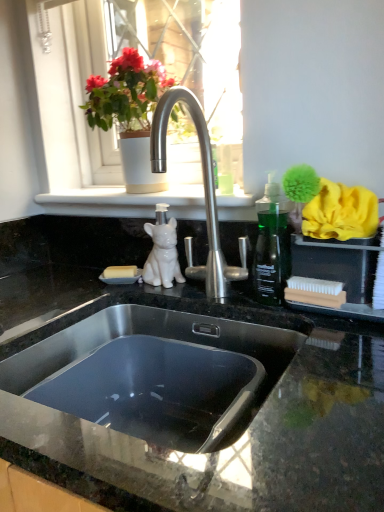
Question: Is black granite countertop at center at the left side of white glossy dog at center?

Choices:
 (A) no
 (B) yes

Answer: (B)

Question: From the image's perspective, is black granite countertop at center located above white glossy dog at center?

Choices:
 (A) yes
 (B) no

Answer: (B)

Question: Does black granite countertop at center have a greater width compared to white glossy dog at center?

Choices:
 (A) yes
 (B) no

Answer: (A)

Question: Can you confirm if black granite countertop at center is positioned to the right of white glossy dog at center?

Choices:
 (A) no
 (B) yes

Answer: (A)

Question: Is black granite countertop at center facing towards white glossy dog at center?

Choices:
 (A) no
 (B) yes

Answer: (A)

Question: Is point (163, 225) closer or farther from the camera than point (43, 349)?

Choices:
 (A) farther
 (B) closer

Answer: (A)

Question: Considering their positions, is white glossy dog at center located in front of or behind stainless steel sink at center?

Choices:
 (A) behind
 (B) front

Answer: (A)

Question: Is white glossy dog at center inside the boundaries of stainless steel sink at center, or outside?

Choices:
 (A) outside
 (B) inside

Answer: (A)

Question: Considering the positions of white glossy dog at center and stainless steel sink at center in the image, is white glossy dog at center wider or thinner than stainless steel sink at center?

Choices:
 (A) wide
 (B) thin

Answer: (B)

Question: From their relative heights in the image, would you say stainless steel sink at center is taller or shorter than black granite countertop at center?

Choices:
 (A) short
 (B) tall

Answer: (A)

Question: Looking at their shapes, would you say stainless steel sink at center is wider or thinner than black granite countertop at center?

Choices:
 (A) wide
 (B) thin

Answer: (B)

Question: Considering their positions, is stainless steel sink at center located in front of or behind black granite countertop at center?

Choices:
 (A) front
 (B) behind

Answer: (B)

Question: Would you say stainless steel sink at center is inside or outside black granite countertop at center?

Choices:
 (A) outside
 (B) inside

Answer: (B)

Question: Visually, is white ceramic pot at upper center positioned to the left or to the right of black granite countertop at center?

Choices:
 (A) right
 (B) left

Answer: (A)

Question: From the image's perspective, is white ceramic pot at upper center positioned above or below black granite countertop at center?

Choices:
 (A) below
 (B) above

Answer: (B)